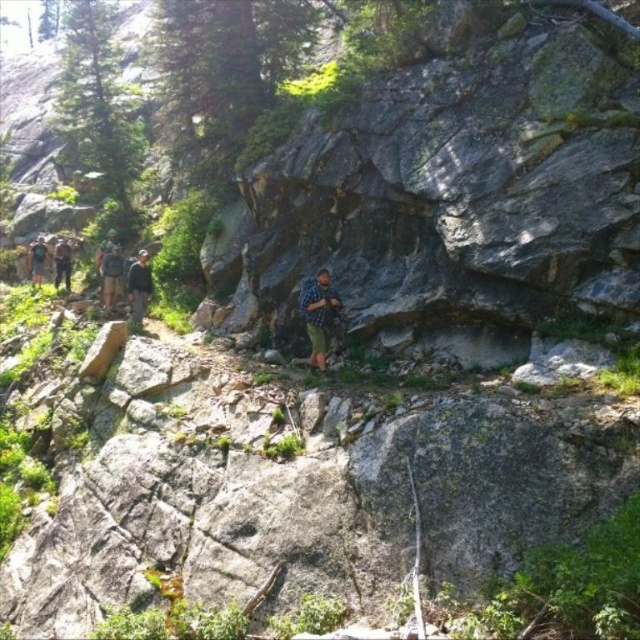
You are a photographer positioned at the back of the group. You want to take a photo that includes both the blue plaid shirt at center and the camouflage jacket at left. Which hiker should you focus on first to ensure both are in frame?

The blue plaid shirt at center is in front of the camouflage jacket at left, so you should focus on the blue plaid shirt at center first to ensure both are visible in the photo.

Please provide the 2D coordinates of the dark gray backpack at center in the image. The answer should be in the format of a point with two decimal values between 0 and 1, such as 0.5,0.5.

The 2D coordinates of the dark gray backpack at center are at point (140, 285).

Consider the image. You are a photographer trying to capture a group photo of the hikers. You want to ensure that both the blue plaid shirt at center and the camouflage jacket at left are clearly visible in the frame. Given their sizes, which hiker should you position closer to the camera to ensure both are equally visible?

The blue plaid shirt at center is smaller in size compared to the camouflage jacket at left. To make both appear equally visible in the photo, position the blue plaid shirt at center closer to the camera since its smaller size needs to be magnified to match the visibility of the larger camouflage jacket at left.